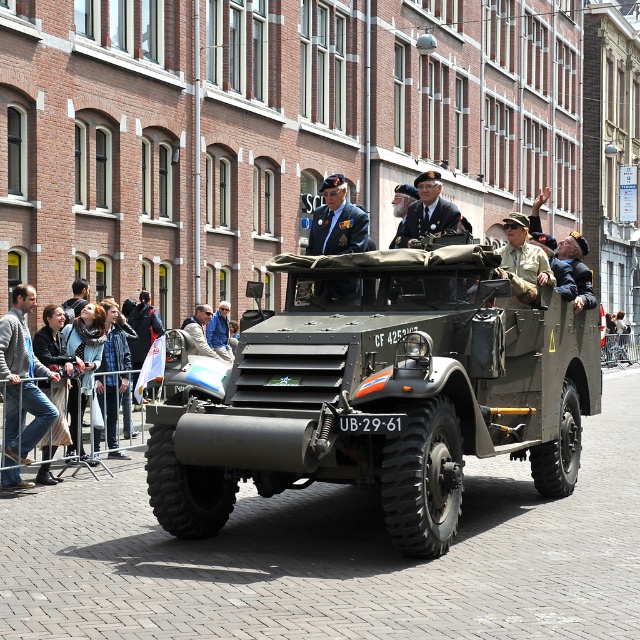
Which of these two, matte green military vehicle at center or jeans at left, stands shorter?

Standing shorter between the two is jeans at left.

Is point (461, 408) behind point (16, 432)?

No, it is not.

This screenshot has width=640, height=640. I want to click on matte green military vehicle at center, so click(x=378, y=392).

Where is `matte green military vehicle at center`? Image resolution: width=640 pixels, height=640 pixels. matte green military vehicle at center is located at coordinates (378, 392).

Who is positioned more to the right, matte green military vehicle at center or light blue denim jacket at center?

From the viewer's perspective, matte green military vehicle at center appears more on the right side.

Between matte green military vehicle at center and light blue denim jacket at center, which one is positioned lower?

matte green military vehicle at center

Locate an element on the screen. matte green military vehicle at center is located at coordinates (378, 392).

Is jeans at left further to the viewer compared to light blue denim jacket at center?

No, it is not.

Is jeans at left closer to the viewer compared to light blue denim jacket at center?

That is True.

The height and width of the screenshot is (640, 640). Find the location of `jeans at left`. jeans at left is located at coordinates (22, 376).